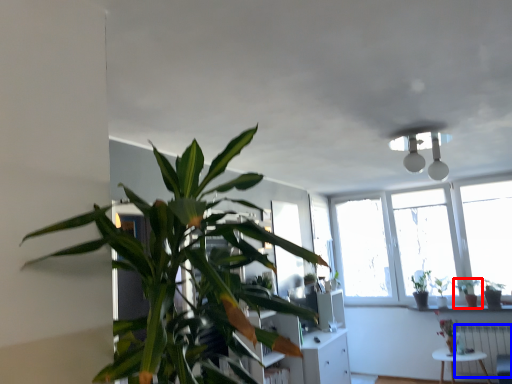
Question: Which object is closer to the camera taking this photo, houseplant (highlighted by a red box) or radiator (highlighted by a blue box)?

Choices:
 (A) houseplant
 (B) radiator

Answer: (B)